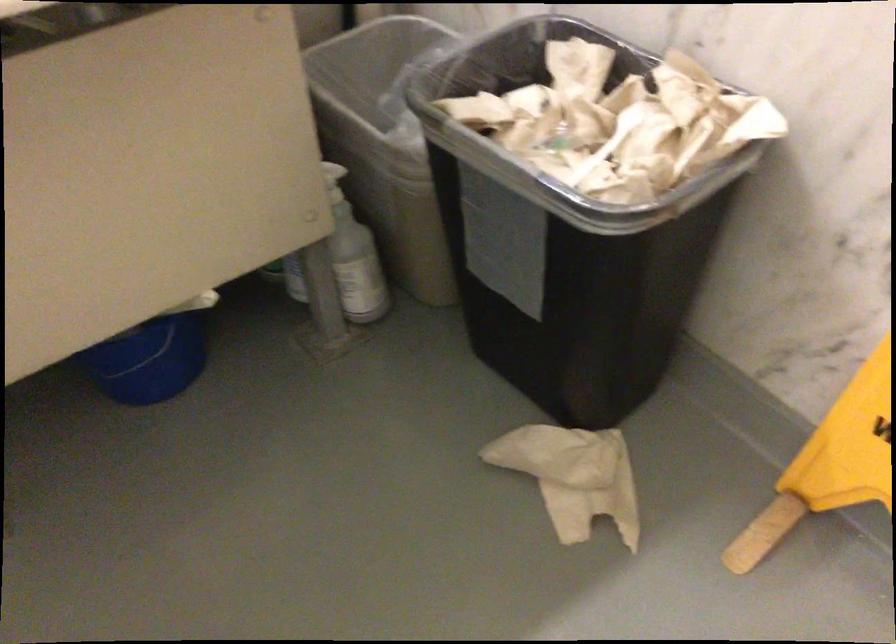
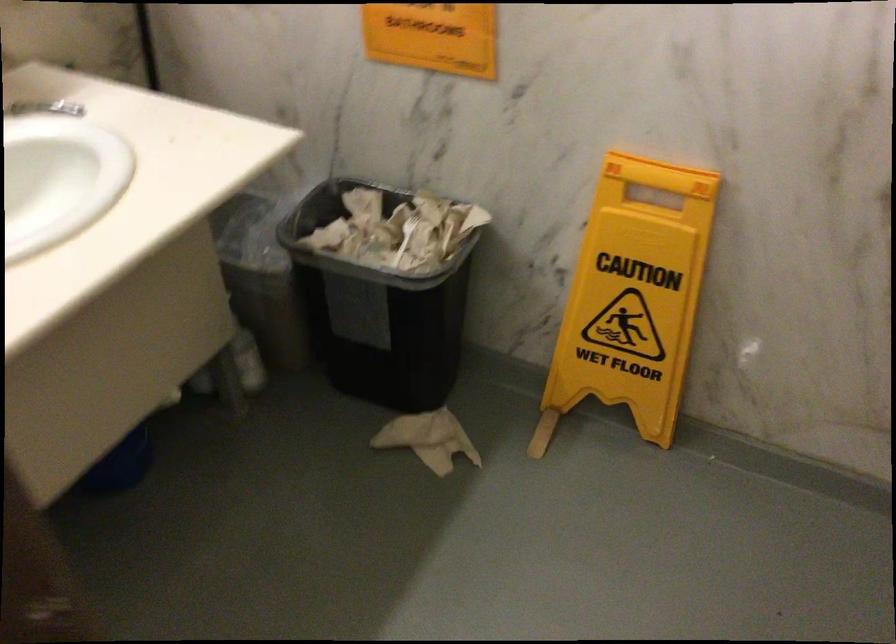
Find the pixel in the second image that matches (528,247) in the first image.

(376, 310)